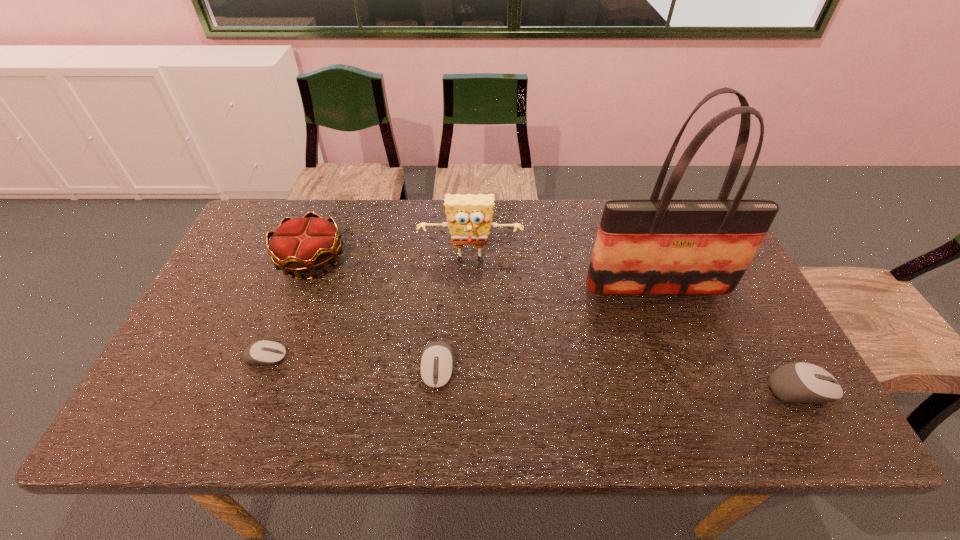
Where is `vacant space at the near edge`? This screenshot has width=960, height=540. vacant space at the near edge is located at coordinates (708, 379).

Identify the location of vacant space at the left edge. The height and width of the screenshot is (540, 960). (242, 296).

Locate an element on the screen. free region at the right edge of the desktop is located at coordinates (768, 348).

You are a GUI agent. You are given a task and a screenshot of the screen. Output one action in this format:
    pyautogui.click(x=<x>, y=<y>)
    Task: Click on the free spot at the near left corner of the desktop
    
    Given the screenshot: What is the action you would take?
    pyautogui.click(x=194, y=380)

Find the location of a particular element. This screenshot has width=960, height=540. empty space between the shopping bag and the fourth shortest object is located at coordinates coord(485,274).

The width and height of the screenshot is (960, 540). I want to click on free point between the tallest object and the second tallest computer equipment, so click(x=548, y=328).

The height and width of the screenshot is (540, 960). What are the coordinates of `free space between the second computer equipment from left to right and the tallest computer equipment` in the screenshot? It's located at (620, 379).

At what (x,y) coordinates should I click in order to perform the action: click on empty space between the second computer equipment from left to right and the crown. Please return your answer as a coordinate pair (x, y). The width and height of the screenshot is (960, 540). Looking at the image, I should click on (374, 314).

The image size is (960, 540). I want to click on free space that is in between the leftmost computer equipment and the second tallest object, so click(369, 309).

Where is `free space between the tallest computer equipment and the shortest computer equipment`? free space between the tallest computer equipment and the shortest computer equipment is located at coordinates (534, 373).